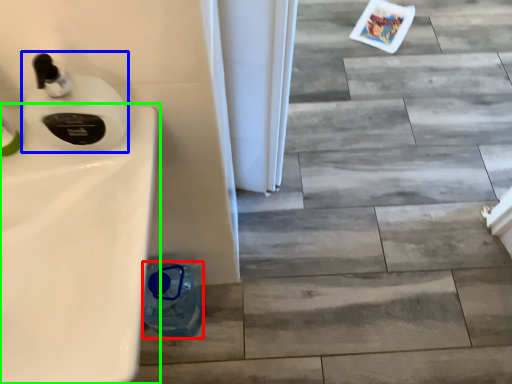
Question: Which object is positioned farthest from bottle (highlighted by a red box)? Select from soap dispenser (highlighted by a blue box) and sink (highlighted by a green box).

Choices:
 (A) soap dispenser
 (B) sink

Answer: (A)